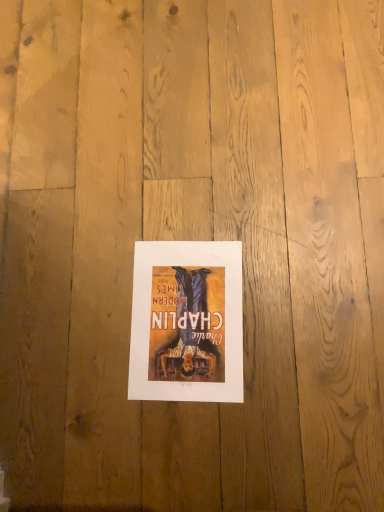
Locate an element on the screen. free space behind matte paper poster at center is located at coordinates (142, 201).